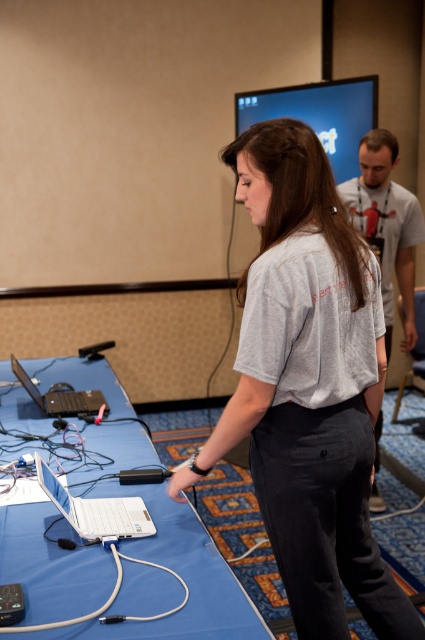
Question: Which of the following is the farthest from the observer?

Choices:
 (A) gray cotton shirt at center
 (B) silver metallic laptop at lower left

Answer: (B)

Question: Which point is farther from the camera taking this photo?

Choices:
 (A) (102, 632)
 (B) (82, 392)
 (C) (272, 177)

Answer: (B)

Question: Can you confirm if gray cotton shirt at center is bigger than silver metallic laptop at lower left?

Choices:
 (A) no
 (B) yes

Answer: (B)

Question: Does white plastic table at lower left appear on the left side of white plastic laptop at lower left?

Choices:
 (A) no
 (B) yes

Answer: (B)

Question: Is white plastic laptop at lower left wider than silver metallic laptop at lower left?

Choices:
 (A) yes
 (B) no

Answer: (B)

Question: Which point is farther from the camera taking this photo?

Choices:
 (A) (204, 624)
 (B) (22, 381)

Answer: (B)